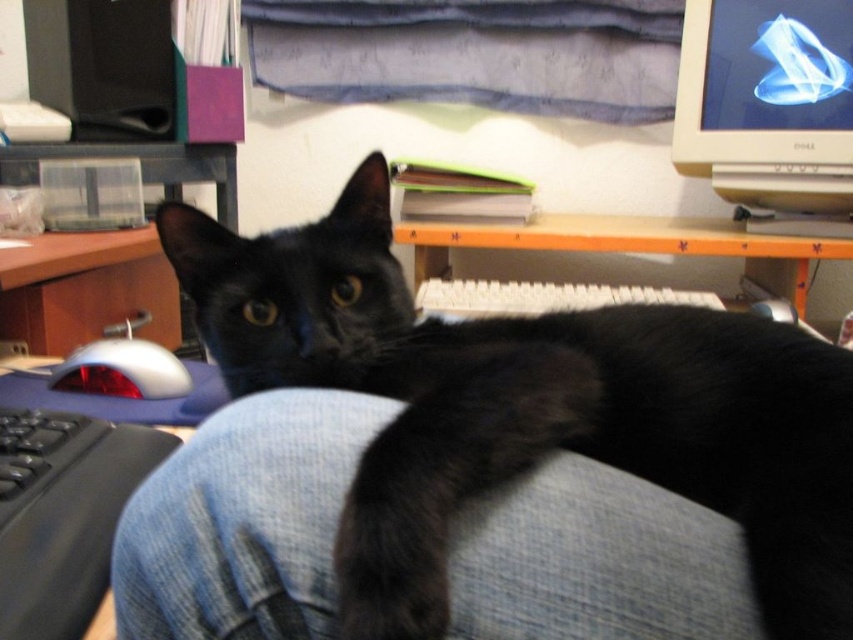
Question: Estimate the real-world distances between objects in this image. Which object is closer to the orange wood computer desk at center?

Choices:
 (A) black fur cat at center
 (B) white glossy mouse at lower left
 (C) matte silver monitor at upper right

Answer: (C)

Question: Is black fur tail at lower center positioned in front of orange wood computer desk at center?

Choices:
 (A) yes
 (B) no

Answer: (A)

Question: Which object is farther from the camera taking this photo?

Choices:
 (A) black plastic keyboard at lower left
 (B) white glossy mouse at lower left

Answer: (B)

Question: Can you confirm if black fur tail at lower center is positioned below black plastic keyboard at lower left?

Choices:
 (A) yes
 (B) no

Answer: (B)

Question: Is orange wood computer desk at center closer to camera compared to white plastic keyboard at center?

Choices:
 (A) yes
 (B) no

Answer: (B)

Question: Which point is closer to the camera?

Choices:
 (A) orange wood computer desk at center
 (B) black fur tail at lower center
 (C) white plastic keyboard at center
 (D) white glossy mouse at lower left

Answer: (B)